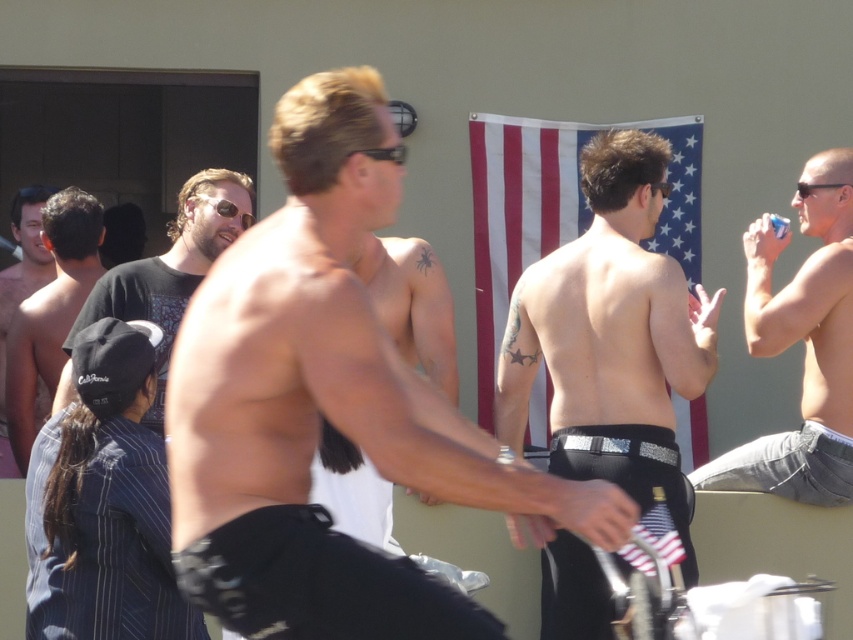
Question: From the image, what is the correct spatial relationship of black matte t-shirt at center in relation to clear plastic cup at upper right?

Choices:
 (A) left
 (B) right

Answer: (A)

Question: Which object is the farthest from the black matte t-shirt at center?

Choices:
 (A) smooth skin torso at center
 (B) black plastic sunglasses at center
 (C) shiny black shirt at left

Answer: (B)

Question: Among these points, which one is farthest from the camera?

Choices:
 (A) (180, 308)
 (B) (561, 157)

Answer: (B)

Question: Is black plastic sunglasses at center above clear plastic cup at upper right?

Choices:
 (A) no
 (B) yes

Answer: (A)

Question: Which point appears farthest from the camera in this image?

Choices:
 (A) [x=352, y=93]
 (B) [x=495, y=132]
 (C) [x=392, y=156]

Answer: (B)

Question: Is american flag at center wider than shiny black shirt at left?

Choices:
 (A) yes
 (B) no

Answer: (A)